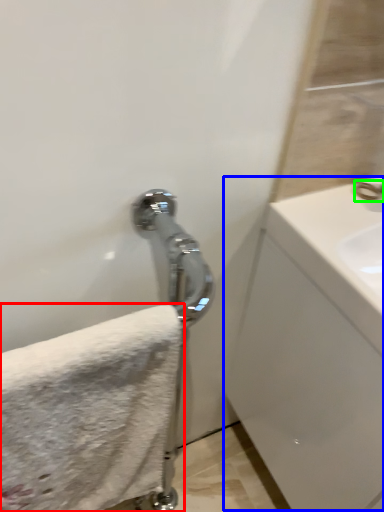
Question: Which object is positioned closest to towel (highlighted by a red box)? Select from counter top (highlighted by a blue box) and faucet (highlighted by a green box).

Choices:
 (A) counter top
 (B) faucet

Answer: (A)